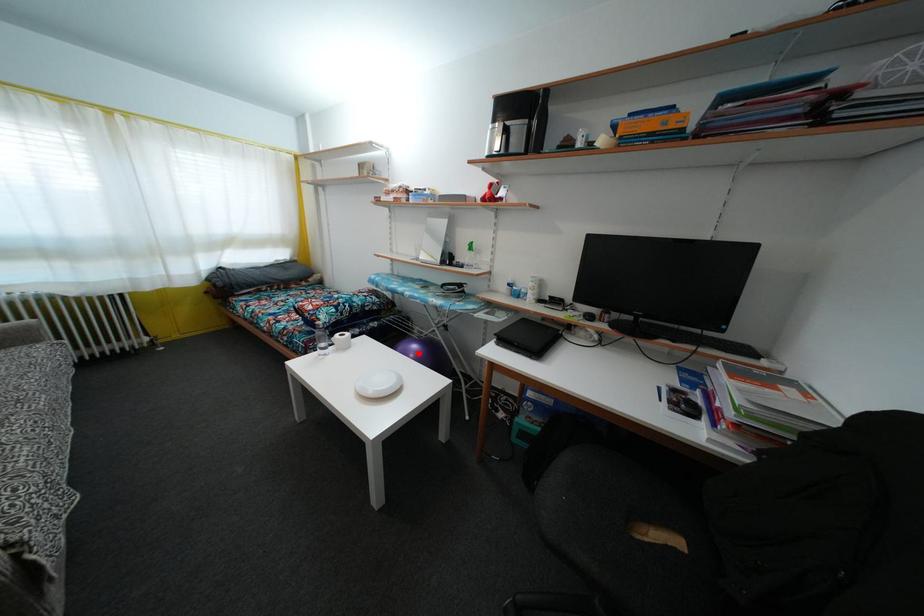
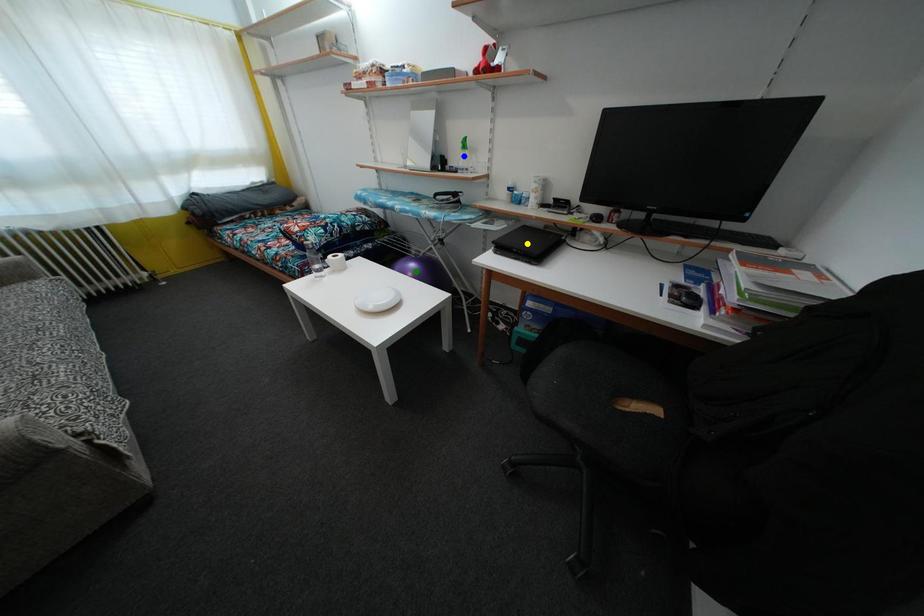
Question: I am providing you with two images of the same scene from different viewpoints. A red point is marked on the first image. You are given multiple points on the second image. Which mark in image 2 goes with the point in image 1?

Choices:
 (A) green point
 (B) blue point
 (C) yellow point

Answer: (A)